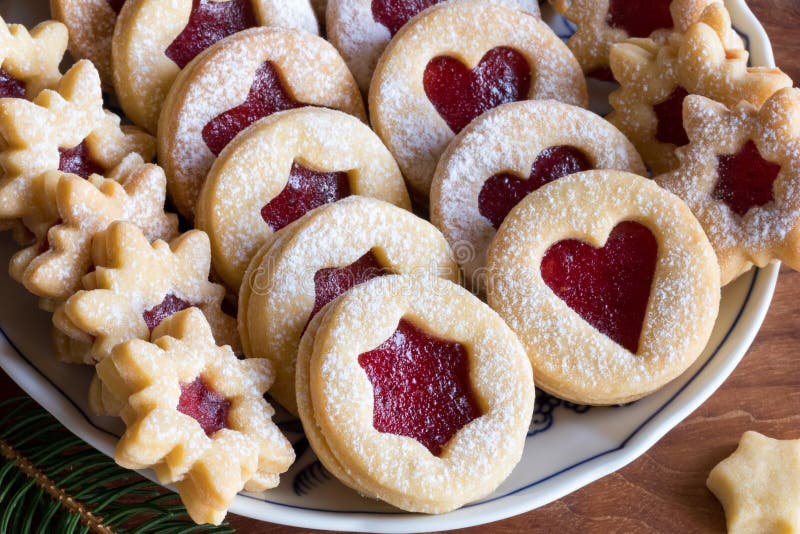
Where is `table`? table is located at coordinates (630, 494), (774, 363), (782, 41).